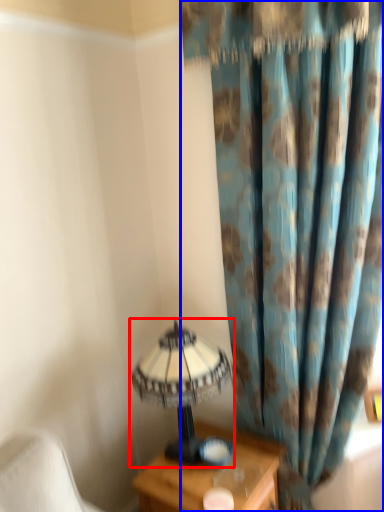
Question: Which of the following is the farthest to the observer, lamp (highlighted by a red box) or curtain (highlighted by a blue box)?

Choices:
 (A) lamp
 (B) curtain

Answer: (A)